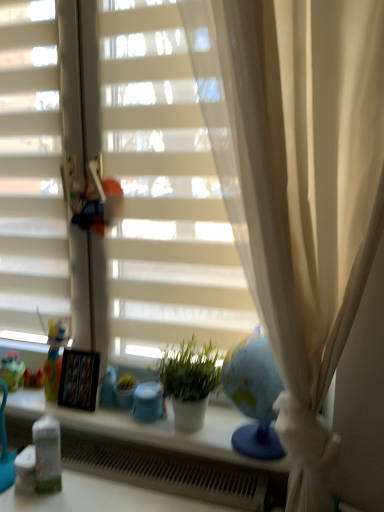
Question: From a real-world perspective, is matte green toy at left above or below white matte plant pot at center?

Choices:
 (A) above
 (B) below

Answer: (B)

Question: Choose the correct answer: Is matte green toy at left inside white matte plant pot at center or outside it?

Choices:
 (A) outside
 (B) inside

Answer: (A)

Question: Which of these objects is positioned closest to the white matte blinds at center?

Choices:
 (A) matte green toy at left
 (B) metallic silver picture frame at center
 (C) matte plastic doll at left
 (D) white plastic radiator at lower center
 (E) blue glossy vase at center

Answer: (B)

Question: Estimate the real-world distances between objects in this image. Which object is closer to the matte green toy at left?

Choices:
 (A) blue glossy vase at center
 (B) matte plastic doll at left
 (C) white matte plant pot at center
 (D) white matte blinds at center
 (E) white matte shutter at left

Answer: (B)